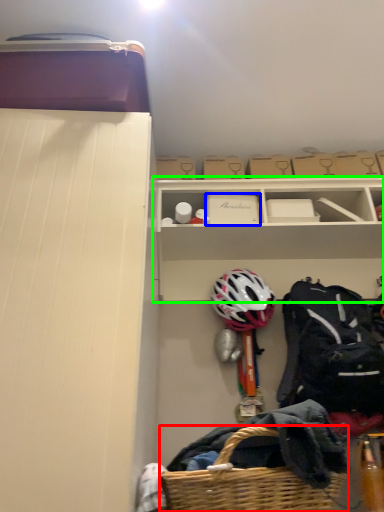
Question: Estimate the real-world distances between objects in this image. Which object is farther from picnic basket (highlighted by a red box), storage box (highlighted by a blue box) or shelf (highlighted by a green box)?

Choices:
 (A) storage box
 (B) shelf

Answer: (A)